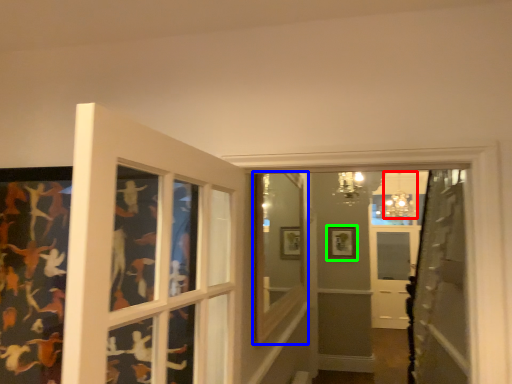
Question: Which object is the closest to the light fixture (highlighted by a red box)? Choose among these: window frame (highlighted by a blue box) or picture frame (highlighted by a green box).

Choices:
 (A) window frame
 (B) picture frame

Answer: (B)